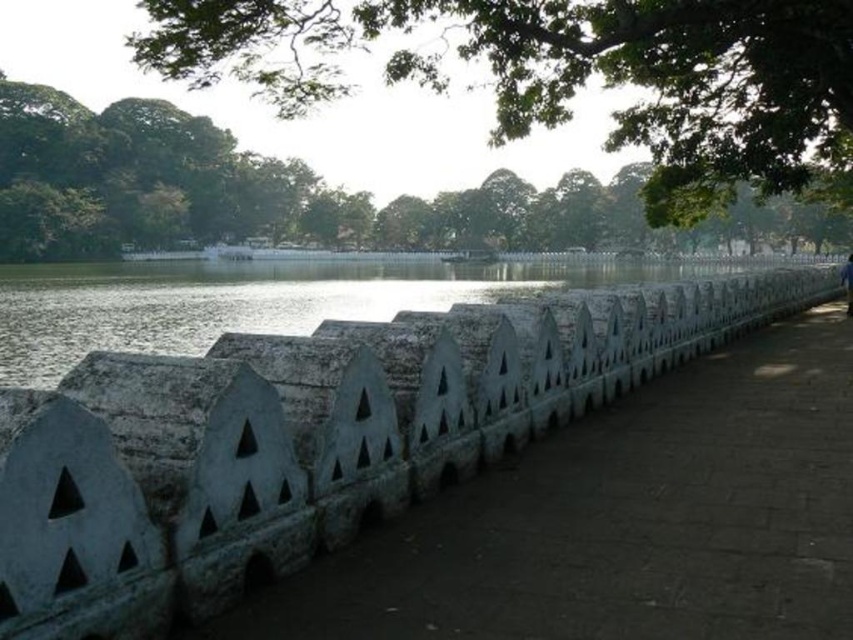
Question: Which of the following is the farthest from the observer?

Choices:
 (A) (834, 275)
 (B) (315, 26)

Answer: (A)

Question: Which of these objects is positioned closest to the blue fabric person at center?

Choices:
 (A) white stone fence at center
 (B) green leafy tree at upper center

Answer: (A)

Question: Which of the following is the farthest from the observer?

Choices:
 (A) (849, 301)
 (B) (119, 412)

Answer: (A)

Question: Is green leafy tree at upper center to the right of blue fabric person at center from the viewer's perspective?

Choices:
 (A) no
 (B) yes

Answer: (A)

Question: Is white stone fence at center bigger than blue fabric person at center?

Choices:
 (A) no
 (B) yes

Answer: (B)

Question: Is green leafy tree at upper center to the right of blue fabric person at center from the viewer's perspective?

Choices:
 (A) no
 (B) yes

Answer: (A)